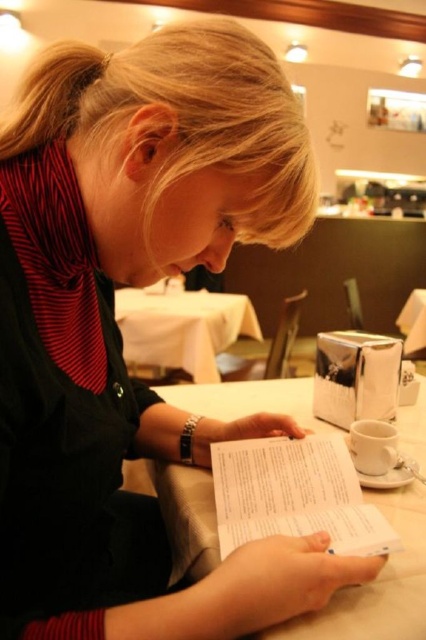
Question: Does white smooth table at center appear under white glossy table at center?

Choices:
 (A) yes
 (B) no

Answer: (A)

Question: Which of these objects is positioned closest to the white glossy table at center?

Choices:
 (A) white smooth table at center
 (B) white paper book at center

Answer: (A)

Question: Is white smooth table at center positioned at the back of white glossy table at center?

Choices:
 (A) yes
 (B) no

Answer: (B)

Question: Can you confirm if white smooth table at center is positioned above white paper book at center?

Choices:
 (A) yes
 (B) no

Answer: (B)

Question: Which of the following is the farthest from the observer?

Choices:
 (A) white smooth table at center
 (B) white paper book at center
 (C) white glossy table at center

Answer: (C)

Question: Which point is closer to the camera taking this photo?

Choices:
 (A) (123, 337)
 (B) (420, 628)

Answer: (B)